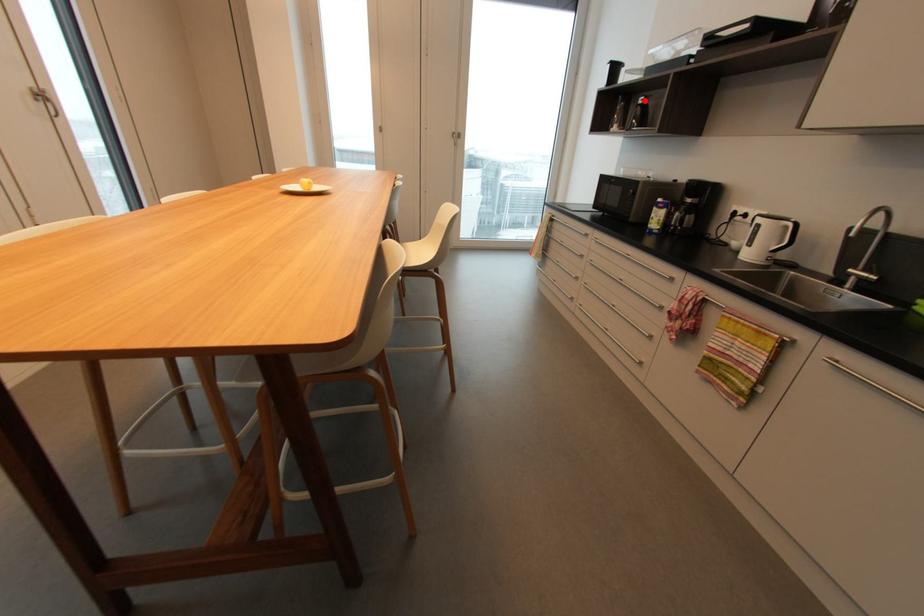
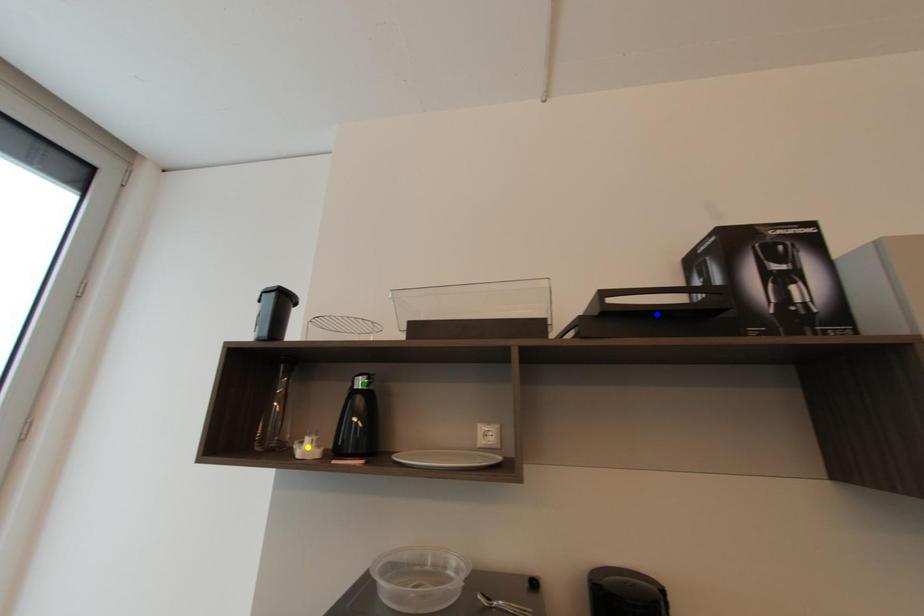
Question: I am providing you with two images of the same scene from different viewpoints. A red point is marked on the first image. You are given multiple points on the second image. Which point in image 2 is actually the same real-world point as the red point in image 1?

Choices:
 (A) green point
 (B) yellow point
 (C) blue point

Answer: (A)